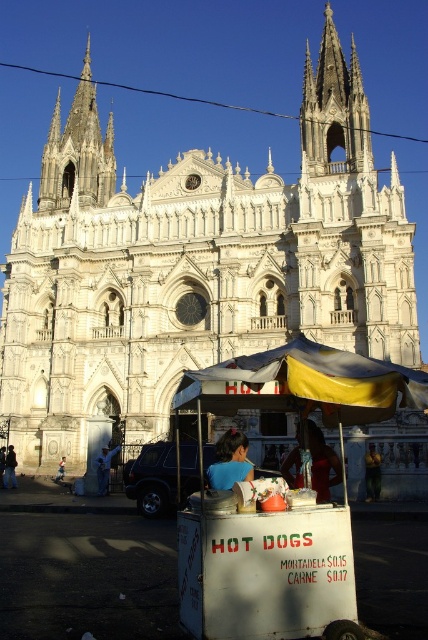
You are a tourist standing in front of the cathedral and want to take a photo of both the yellow fabric canopy at lower center and the white stone spire at upper left. Which object should you zoom in on first to ensure both are in the frame?

You should zoom in on the yellow fabric canopy at lower center first because it is smaller than the white stone spire at upper left, so it requires more focus to capture its details while keeping the spire in view.

You are standing in front of the cathedral and want to take a photo that includes both the hot dog stand and the cathedral. You notice two points marked in the scene. Which point is closer to you, point (338,109) or point (101,451)?

Point (338,109) is further to the viewer than point (101,451), so point (101,451) is closer to you.